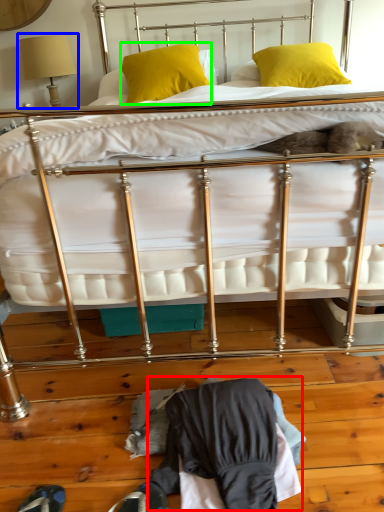
Question: Estimate the real-world distances between objects in this image. Which object is closer to clothing (highlighted by a red box), table lamp (highlighted by a blue box) or pillow (highlighted by a green box)?

Choices:
 (A) table lamp
 (B) pillow

Answer: (B)